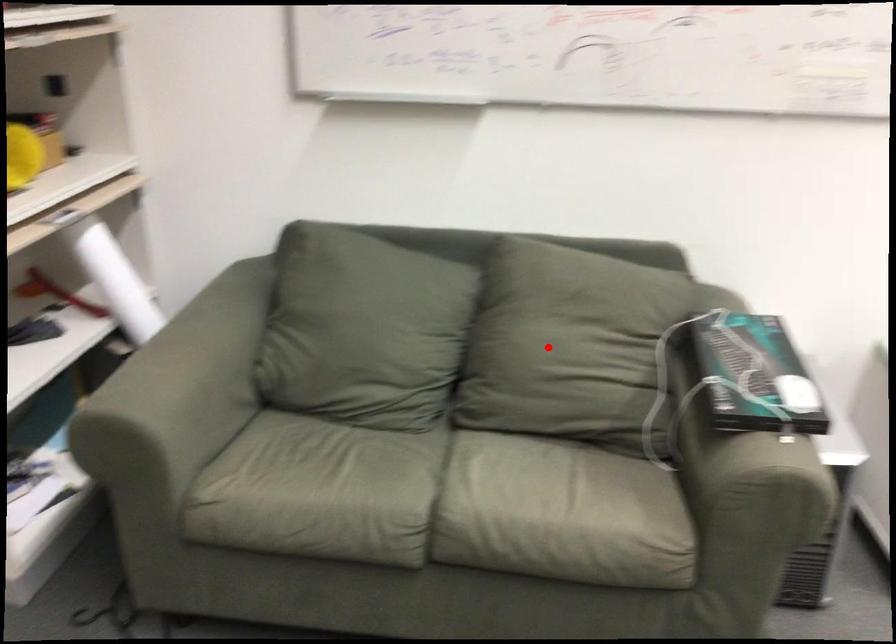
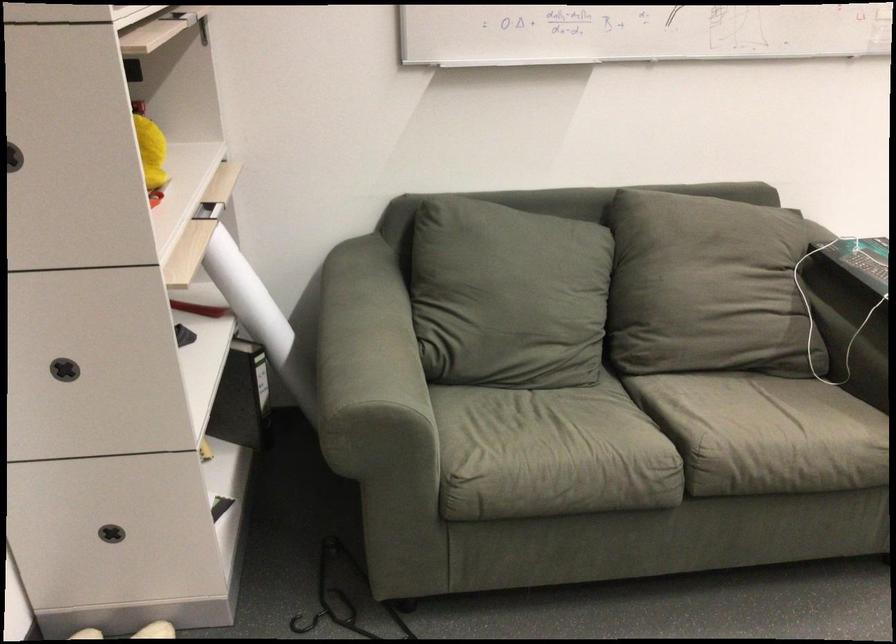
Locate, in the second image, the point that corresponds to the highlighted location in the first image.

(707, 287)